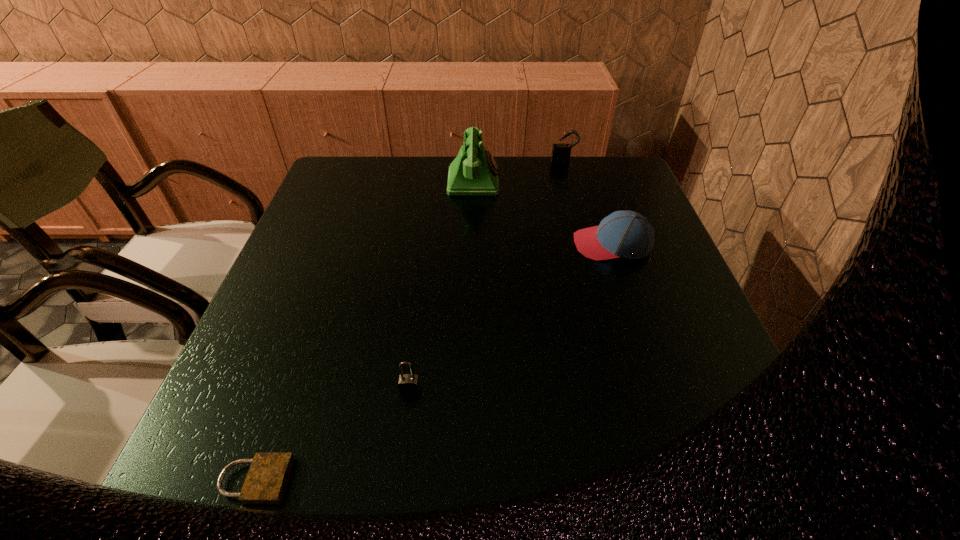
This screenshot has height=540, width=960. I want to click on the third object from right to left, so click(474, 171).

At what (x,y) coordinates should I click in order to perform the action: click on the tallest object. Please return your answer as a coordinate pair (x, y). This screenshot has height=540, width=960. Looking at the image, I should click on (474, 171).

Where is `the second tallest object`? This screenshot has width=960, height=540. the second tallest object is located at coordinates (561, 153).

Where is `the farthest padlock`? This screenshot has width=960, height=540. the farthest padlock is located at coordinates (561, 153).

Identify the location of the third farthest object. (624, 233).

At what (x,y) coordinates should I click in order to perform the action: click on the second padlock from right to left. Please return your answer as a coordinate pair (x, y). Looking at the image, I should click on (409, 384).

This screenshot has width=960, height=540. I want to click on the second tallest padlock, so click(409, 384).

What are the coordinates of `the leftmost object` in the screenshot? It's located at (265, 483).

Identify the location of the nearest object. (265, 483).

Locate an element on the screen. The image size is (960, 540). free space located on the dial of the telephone is located at coordinates (537, 181).